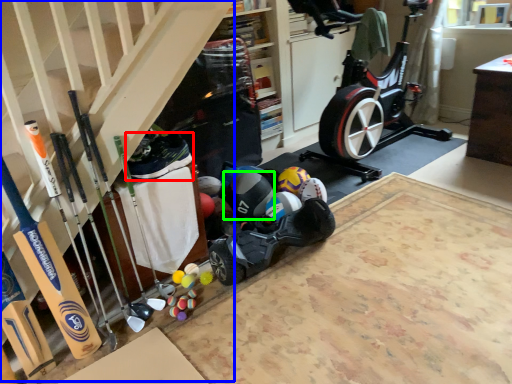
Question: Which is farther away from shoe (highlighted by a red box)? stairs (highlighted by a blue box) or sports equipment (highlighted by a green box)?

Choices:
 (A) stairs
 (B) sports equipment

Answer: (B)